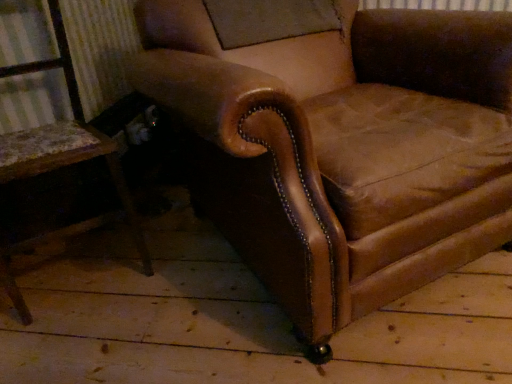
Question: Relative to brown leather chair at left, the first chair when ordered from left to right, is brown leather armchair at center, acting as the 1th chair starting from the right, in front or behind?

Choices:
 (A) front
 (B) behind

Answer: (A)

Question: Is brown leather armchair at center, acting as the 1th chair starting from the right, situated inside brown leather chair at left, the first chair when ordered from left to right, or outside?

Choices:
 (A) inside
 (B) outside

Answer: (B)

Question: From the image's perspective, is brown leather armchair at center, the 2th chair in the left-to-right sequence, located above or below brown leather chair at left, the first chair when ordered from left to right?

Choices:
 (A) below
 (B) above

Answer: (B)

Question: Considering the positions of brown leather chair at left, the 2th chair when ordered from right to left, and brown leather armchair at center, the 2th chair in the left-to-right sequence, in the image, is brown leather chair at left, the 2th chair when ordered from right to left, wider or thinner than brown leather armchair at center, the 2th chair in the left-to-right sequence,?

Choices:
 (A) thin
 (B) wide

Answer: (A)

Question: In the image, is brown leather chair at left, the first chair when ordered from left to right, positioned in front of or behind brown leather armchair at center, the 2th chair in the left-to-right sequence?

Choices:
 (A) behind
 (B) front

Answer: (A)

Question: Based on their positions, is brown leather chair at left, the first chair when ordered from left to right, located to the left or right of brown leather armchair at center, the 2th chair in the left-to-right sequence?

Choices:
 (A) left
 (B) right

Answer: (A)

Question: From a real-world perspective, is brown leather chair at left, the 2th chair when ordered from right to left, positioned above or below brown leather armchair at center, acting as the 1th chair starting from the right?

Choices:
 (A) below
 (B) above

Answer: (B)